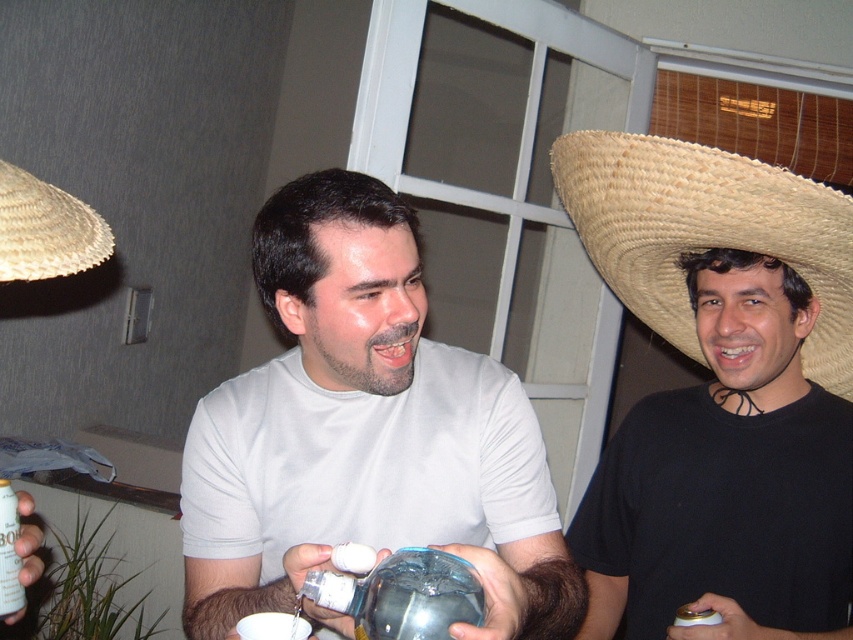
Which is more to the right, white matte shirt at center or metallic silver can at lower left?

Positioned to the right is white matte shirt at center.

Is point (305, 369) positioned after point (3, 486)?

Yes, point (305, 369) is farther from viewer.

This screenshot has width=853, height=640. Identify the location of white matte shirt at center. (364, 433).

This screenshot has height=640, width=853. Find the location of `white matte shirt at center`. white matte shirt at center is located at coordinates (364, 433).

Which is more to the right, white matte shirt at center or straw woven sombrero at upper right?

From the viewer's perspective, straw woven sombrero at upper right appears more on the right side.

Between point (370, 412) and point (732, 218), which one is positioned in front?

Positioned in front is point (370, 412).

Does point (410, 394) come in front of point (701, 240)?

Yes, point (410, 394) is in front of point (701, 240).

Where is `white matte shirt at center`? The image size is (853, 640). white matte shirt at center is located at coordinates (364, 433).

Who is lower down, straw woven sombrero at upper right or beige straw sombrero at upper left?

straw woven sombrero at upper right is below.

Does straw woven sombrero at upper right appear over beige straw sombrero at upper left?

No.

Image resolution: width=853 pixels, height=640 pixels. Identify the location of straw woven sombrero at upper right. click(706, 232).